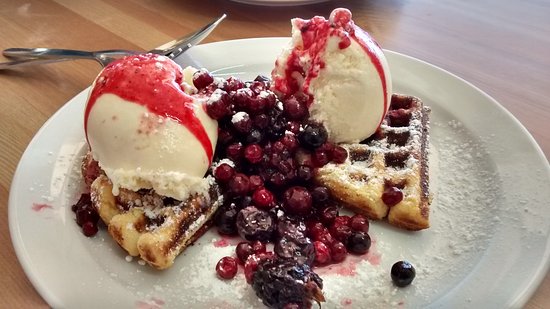
You are a GUI agent. You are given a task and a screenshot of the screen. Output one action in this format:
    pyautogui.click(x=<x>, y=<y>)
    Task: Click on the wooden table
    
    Given the screenshot: What is the action you would take?
    pyautogui.click(x=36, y=101)